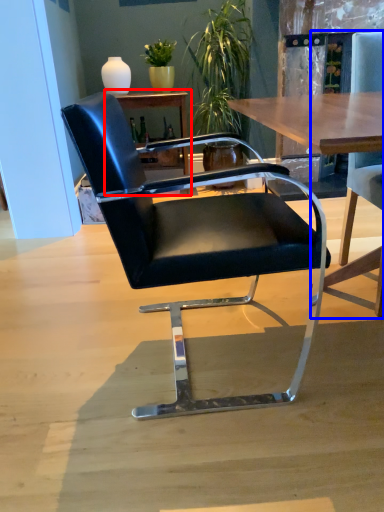
Question: Which object appears closest to the camera in this image, table (highlighted by a red box) or chair (highlighted by a blue box)?

Choices:
 (A) table
 (B) chair

Answer: (B)